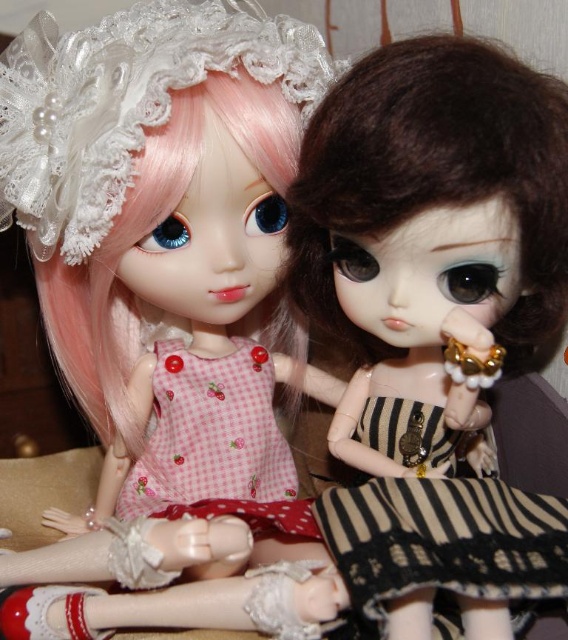
Question: Does matte black doll at center have a larger size compared to black striped fabric at center?

Choices:
 (A) no
 (B) yes

Answer: (B)

Question: Considering the real-world distances, which object is closest to the black striped fabric at center?

Choices:
 (A) matte pink hair at upper left
 (B) pink checkered fabric dress at center

Answer: (B)

Question: Which is farther from the matte black doll at center?

Choices:
 (A) pink checkered fabric dress at center
 (B) matte pink hair at upper left
 (C) black striped fabric at center

Answer: (A)

Question: Which object is farther from the camera taking this photo?

Choices:
 (A) matte black doll at center
 (B) black striped fabric at center

Answer: (A)

Question: Is matte black doll at center to the right of black striped fabric at center from the viewer's perspective?

Choices:
 (A) yes
 (B) no

Answer: (B)

Question: Is matte pink hair at upper left closer to the viewer compared to pink checkered fabric dress at center?

Choices:
 (A) no
 (B) yes

Answer: (B)